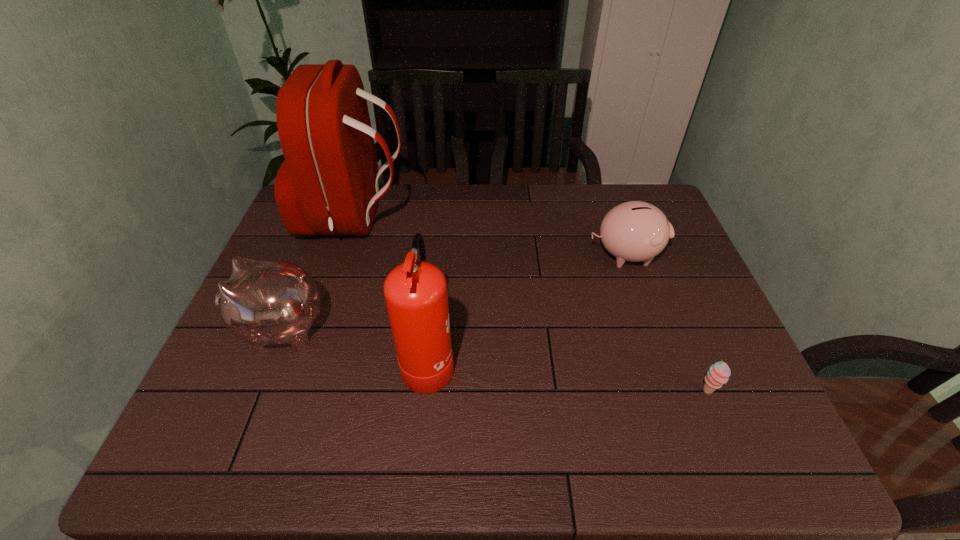
Locate an element on the screen. The height and width of the screenshot is (540, 960). free space at the right edge of the desktop is located at coordinates (658, 282).

You are a GUI agent. You are given a task and a screenshot of the screen. Output one action in this format:
    pyautogui.click(x=<x>, y=<y>)
    Task: Click on the free space between the nearer piggy bank and the shorter piggy bank
    This screenshot has width=960, height=540.
    Given the screenshot: What is the action you would take?
    pyautogui.click(x=453, y=292)

What are the coordinates of `unoccupied area between the taller piggy bank and the backpack` in the screenshot? It's located at (319, 274).

The height and width of the screenshot is (540, 960). I want to click on free spot between the farther piggy bank and the fire extinguisher, so click(x=527, y=307).

This screenshot has height=540, width=960. I want to click on vacant point located between the fourth tallest object and the third object from left to right, so click(527, 307).

Image resolution: width=960 pixels, height=540 pixels. In order to click on free space between the sherbert and the farther piggy bank in this screenshot , I will do `click(666, 323)`.

Identify which object is the nearest to the fourth shortest object. Please provide its 2D coordinates. Your answer should be formatted as a tuple, i.e. [(x, y)], where the tuple contains the x and y coordinates of a point satisfying the conditions above.

[(264, 302)]

The height and width of the screenshot is (540, 960). Find the location of `the third closest object to the tallest object`. the third closest object to the tallest object is located at coordinates (634, 231).

What are the coordinates of `vacant space that satisfies the following two spatial constraints: 1. on the front side of the shorter piggy bank; 2. on the front facing side of the third tallest object` in the screenshot? It's located at (650, 329).

This screenshot has height=540, width=960. Identify the location of free location that satisfies the following two spatial constraints: 1. on the front facing side of the shortest object; 2. on the right side of the nearer piggy bank. (256, 392).